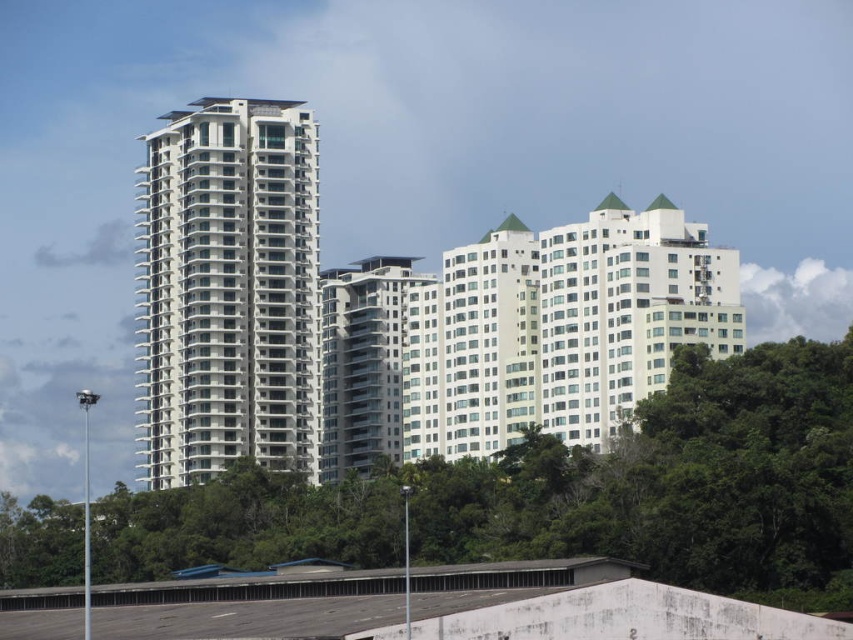
You are standing in the parking lot looking at the buildings. There are two points marked in the image. The first point is at coordinates point (202,170) and the second point is at point (381,442). Which of these points is closer to you?

The point at coordinates point (202,170) is closer to you than the point at point (381,442).

You are driving a delivery van that needs to park in the parking lot near the white smooth building at left and the white glass building at center. Which building should you park closer to if you want to be equidistant from both?

You should park closer to the white glass building at center because the white smooth building at left is closer to the viewer, so positioning yourself near the farther building balances the distance between both.

You are standing in the parking lot and want to locate the white glass building at center. Which direction should you look relative to the green leafy tree at center?

The green leafy tree at center is to the right of the white glass building at center, so you should look to the left of the green leafy tree at center to find the white glass building at center.